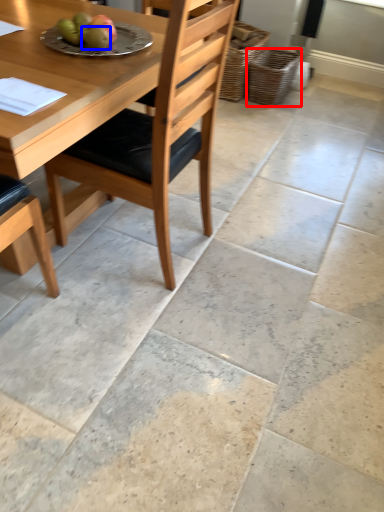
Question: Which of the following is the farthest to the observer, basket (highlighted by a red box) or fruit (highlighted by a blue box)?

Choices:
 (A) basket
 (B) fruit

Answer: (A)